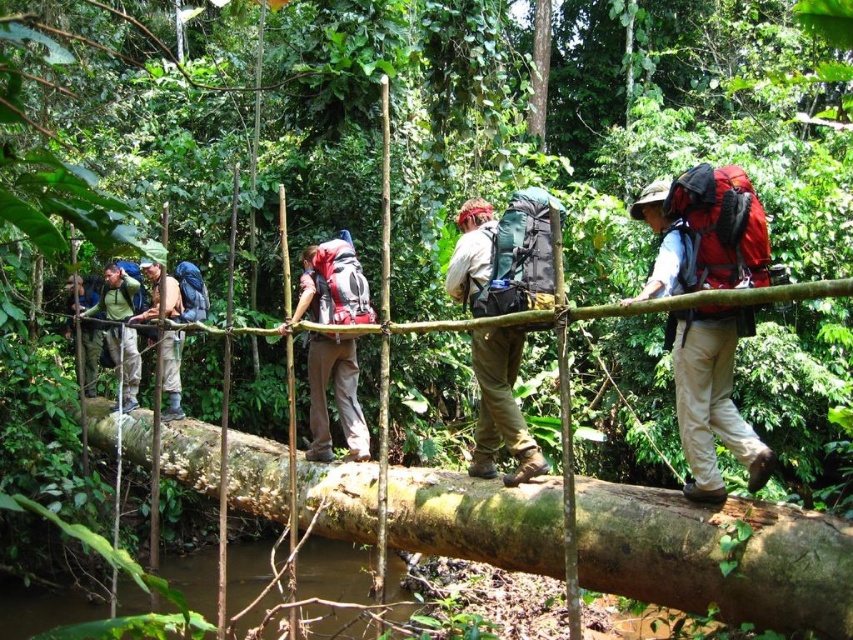
Question: Can you confirm if green rough wood log at center is thinner than matte khaki pants at center?

Choices:
 (A) no
 (B) yes

Answer: (B)

Question: Can you confirm if matte red backpack at center is positioned to the right of matte khaki pants at left?

Choices:
 (A) no
 (B) yes

Answer: (B)

Question: Which point appears closest to the camera in this image?

Choices:
 (A) (496, 435)
 (B) (80, 285)
 (C) (170, 342)
 (D) (767, 502)

Answer: (D)

Question: Which object is the closest to the matte khaki pants at center?

Choices:
 (A) matte khaki pants at left
 (B) matte red backpack at center
 (C) matte green backpack at left
 (D) matte black backpack at center

Answer: (C)

Question: Does matte gray backpack at center appear under matte khaki pants at left?

Choices:
 (A) no
 (B) yes

Answer: (B)

Question: Which of the following is the closest to the observer?

Choices:
 (A) (697, 362)
 (B) (547, 241)
 (C) (634, 532)
 (D) (67, 300)

Answer: (C)